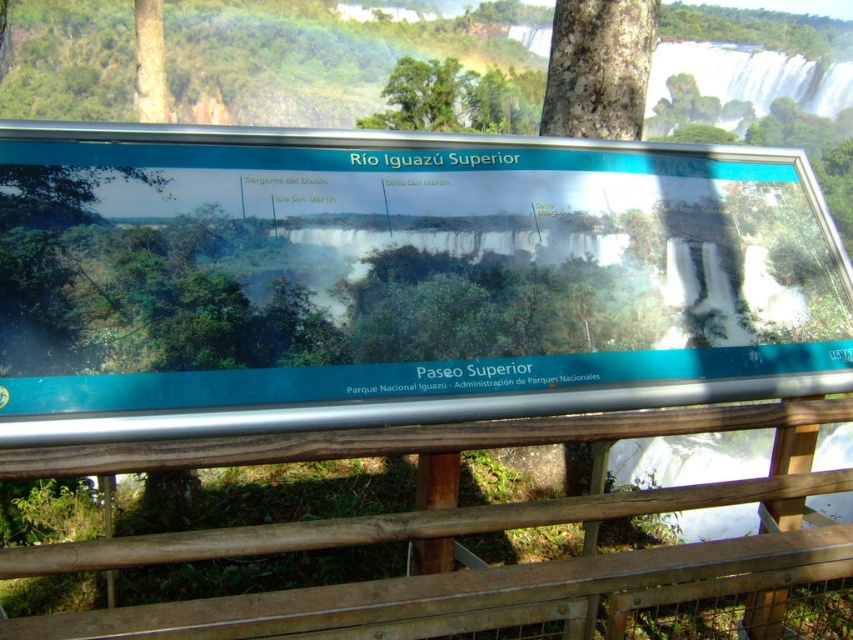
In the scene shown: You are standing at the Paseo Superior viewpoint and notice a wooden structure and a tree in the scene. Which object is taller between the wooden at lower center and the brown rough bark tree at upper center?

The wooden at lower center is taller than the brown rough bark tree at upper center according to the description provided.

Looking at this image, what is the 2D coordinate of the wooden at lower center?

The wooden at lower center is located at point (485, 532).

You are a park ranger who needs to place a new sign exactly halfway between the wooden at lower center and another object. Which object is the other one?

The other object is the signboard mounted on the wooden railing at lower center, and the distance between them is 1.57 meters.